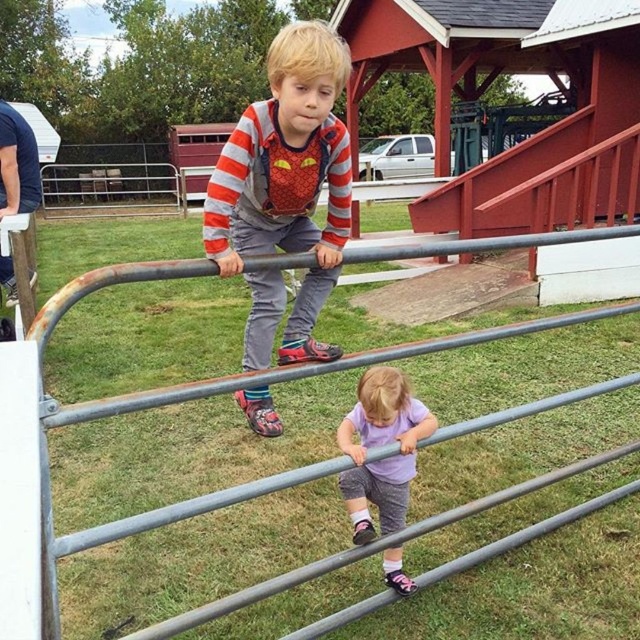
Is matte gray overalls at center above purple fabric shirt at lower center?

Yes.

Who is positioned more to the right, matte gray overalls at center or purple fabric shirt at lower center?

From the viewer's perspective, purple fabric shirt at lower center appears more on the right side.

Does point (236, 188) lie behind point (394, 461)?

No, it is not.

This screenshot has width=640, height=640. What are the coordinates of `matte gray overalls at center` in the screenshot? It's located at (288, 177).